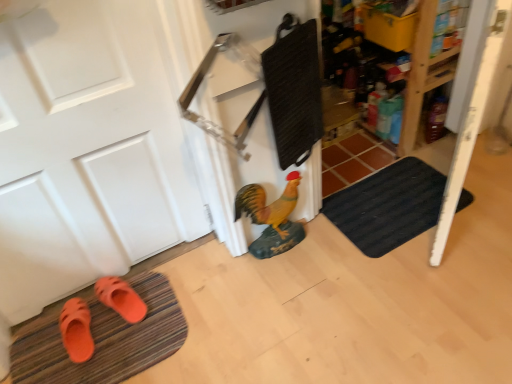
This screenshot has width=512, height=384. What are the coordinates of `vacant space to the left of orange rubber sandals at lower left, the 2th footwear viewed from the right` in the screenshot? It's located at (35, 345).